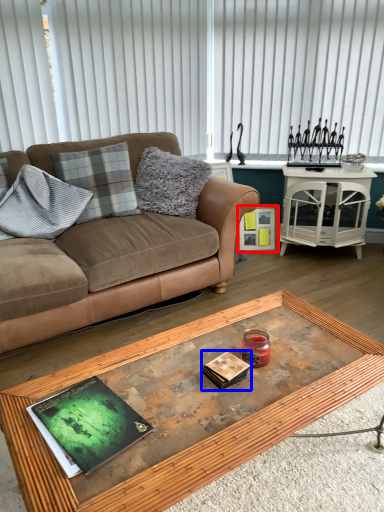
Question: Among these objects, which one is nearest to the camera, picture frame (highlighted by a red box) or magazine (highlighted by a blue box)?

Choices:
 (A) picture frame
 (B) magazine

Answer: (B)